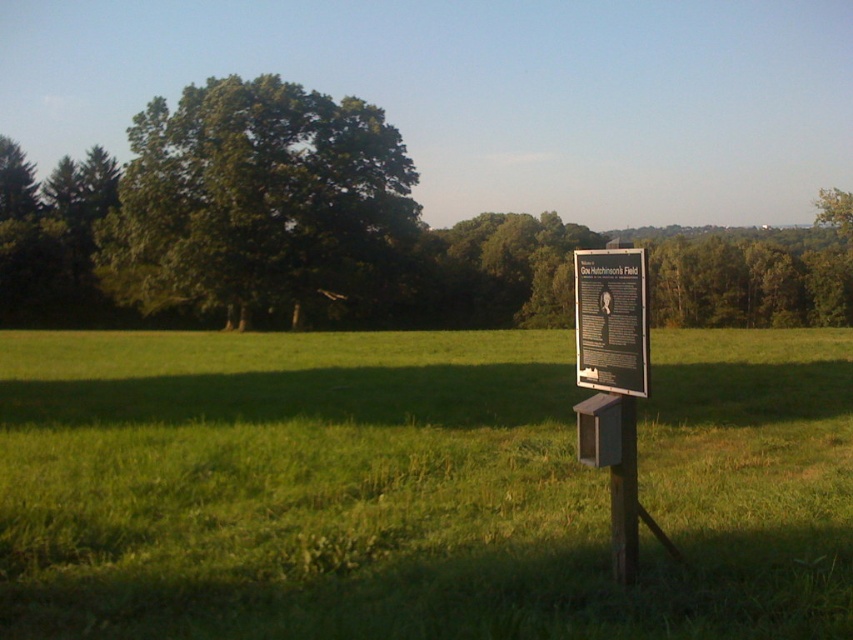
Question: Which object is the farthest from the green grass at center?

Choices:
 (A) green leafy tree at center
 (B) matte black sign at center
 (C) wooden post at center
 (D) wooden sign at center

Answer: (A)

Question: Estimate the real-world distances between objects in this image. Which object is closer to the green leafy tree at upper left?

Choices:
 (A) wooden post at center
 (B) green grass at center
 (C) green leafy tree at center
 (D) matte black sign at center

Answer: (B)

Question: Does green grass at center have a smaller size compared to wooden post at center?

Choices:
 (A) yes
 (B) no

Answer: (B)

Question: Which point is farther to the camera?

Choices:
 (A) green grass at center
 (B) green leafy tree at center

Answer: (B)

Question: Is green grass at center to the left of wooden post at center from the viewer's perspective?

Choices:
 (A) yes
 (B) no

Answer: (A)

Question: Is green grass at center below green leafy tree at upper left?

Choices:
 (A) no
 (B) yes

Answer: (B)